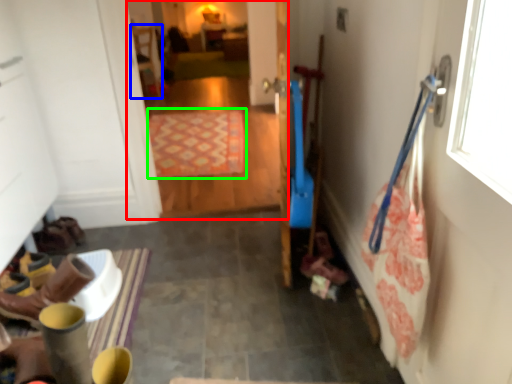
Question: Estimate the real-world distances between objects in this image. Which object is farther from corridor (highlighted by a red box), chair (highlighted by a blue box) or mat (highlighted by a green box)?

Choices:
 (A) chair
 (B) mat

Answer: (A)